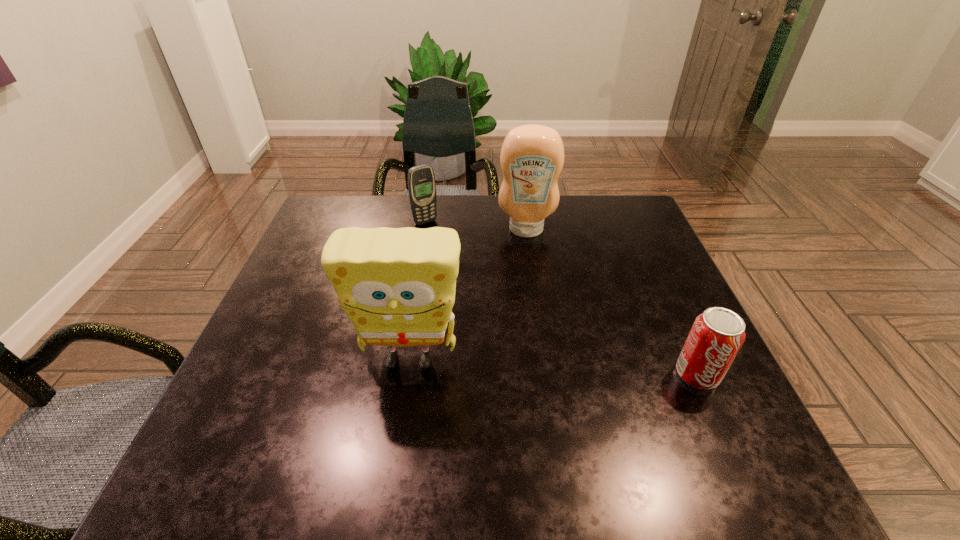
At what (x,y) coordinates should I click in order to perform the action: click on vacant space at the left edge of the desktop. Please return your answer as a coordinate pair (x, y). This screenshot has width=960, height=540. Looking at the image, I should click on (292, 354).

The height and width of the screenshot is (540, 960). In the image, there is a desktop. In order to click on vacant region at the right edge in this screenshot , I will do `click(649, 291)`.

Identify the location of vacant space at the far left corner. Image resolution: width=960 pixels, height=540 pixels. (346, 212).

Locate an element on the screen. The height and width of the screenshot is (540, 960). free space at the far right corner is located at coordinates (613, 196).

I want to click on free area in between the condiment and the cellular telephone, so [x=476, y=226].

Locate an element on the screen. Image resolution: width=960 pixels, height=540 pixels. vacant space in between the condiment and the rightmost object is located at coordinates (612, 302).

Locate an element on the screen. The height and width of the screenshot is (540, 960). vacant area between the third object from left to right and the cellular telephone is located at coordinates (476, 226).

The image size is (960, 540). I want to click on unoccupied position between the shortest object and the second object from right to left, so click(x=612, y=302).

This screenshot has width=960, height=540. I want to click on free space between the shortest object and the cellular telephone, so click(x=562, y=298).

The image size is (960, 540). I want to click on free space between the condiment and the sponge, so click(x=468, y=295).